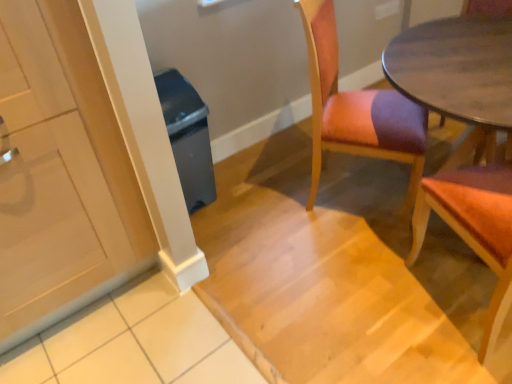
Question: From the image's perspective, is white glossy cabinet at left beneath wooden chair at right, marked as the first chair in a right-to-left arrangement?

Choices:
 (A) yes
 (B) no

Answer: (B)

Question: Is white glossy cabinet at left far from wooden chair at right, arranged as the 2th chair when viewed from the left?

Choices:
 (A) no
 (B) yes

Answer: (B)

Question: From a real-world perspective, is white glossy cabinet at left over wooden chair at right, arranged as the 2th chair when viewed from the left?

Choices:
 (A) no
 (B) yes

Answer: (B)

Question: Does white glossy cabinet at left appear on the left side of wooden chair at right, marked as the first chair in a right-to-left arrangement?

Choices:
 (A) no
 (B) yes

Answer: (B)

Question: Does white glossy cabinet at left have a greater width compared to wooden chair at right, arranged as the 2th chair when viewed from the left?

Choices:
 (A) yes
 (B) no

Answer: (A)

Question: Considering the relative positions of white glossy cabinet at left and wooden chair at right, arranged as the 2th chair when viewed from the left, in the image provided, is white glossy cabinet at left to the right of wooden chair at right, arranged as the 2th chair when viewed from the left, from the viewer's perspective?

Choices:
 (A) no
 (B) yes

Answer: (A)

Question: Does gray plastic trash can at left have a greater height compared to wooden upholstered chair at center, the first chair viewed from the left?

Choices:
 (A) yes
 (B) no

Answer: (B)

Question: Does gray plastic trash can at left have a lesser height compared to wooden upholstered chair at center, acting as the 2th chair starting from the right?

Choices:
 (A) yes
 (B) no

Answer: (A)

Question: From a real-world perspective, is gray plastic trash can at left located beneath wooden upholstered chair at center, acting as the 2th chair starting from the right?

Choices:
 (A) no
 (B) yes

Answer: (B)

Question: Does gray plastic trash can at left lie in front of wooden upholstered chair at center, the first chair viewed from the left?

Choices:
 (A) yes
 (B) no

Answer: (B)

Question: Is gray plastic trash can at left oriented towards wooden upholstered chair at center, the first chair viewed from the left?

Choices:
 (A) no
 (B) yes

Answer: (A)

Question: Is gray plastic trash can at left facing away from wooden upholstered chair at center, acting as the 2th chair starting from the right?

Choices:
 (A) no
 (B) yes

Answer: (A)

Question: Is wooden chair at right, arranged as the 2th chair when viewed from the left, not inside gray plastic trash can at left?

Choices:
 (A) no
 (B) yes

Answer: (B)